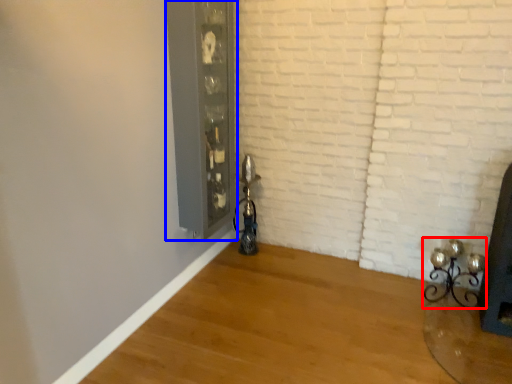
Question: Among these objects, which one is nearest to the camera, candle holder (highlighted by a red box) or glass door (highlighted by a blue box)?

Choices:
 (A) candle holder
 (B) glass door

Answer: (B)